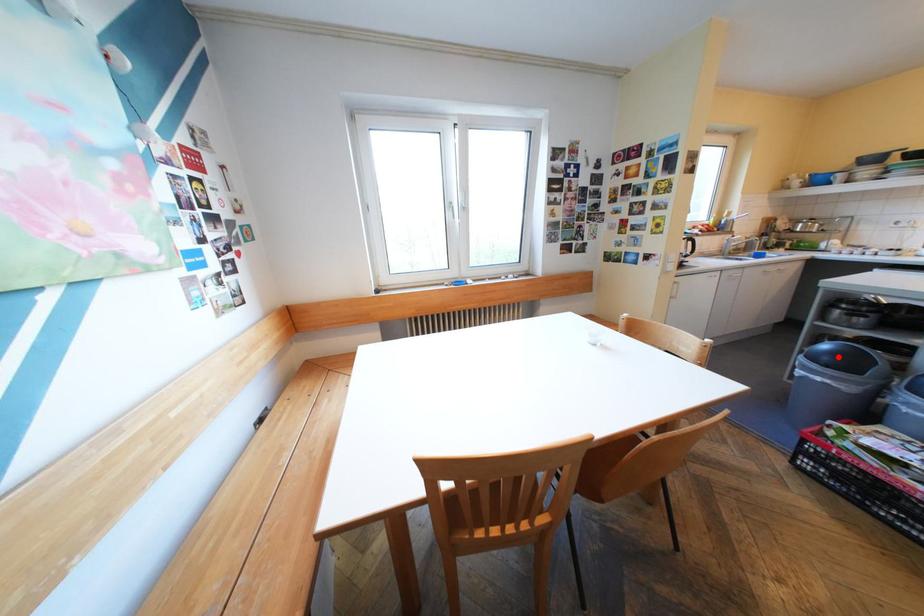
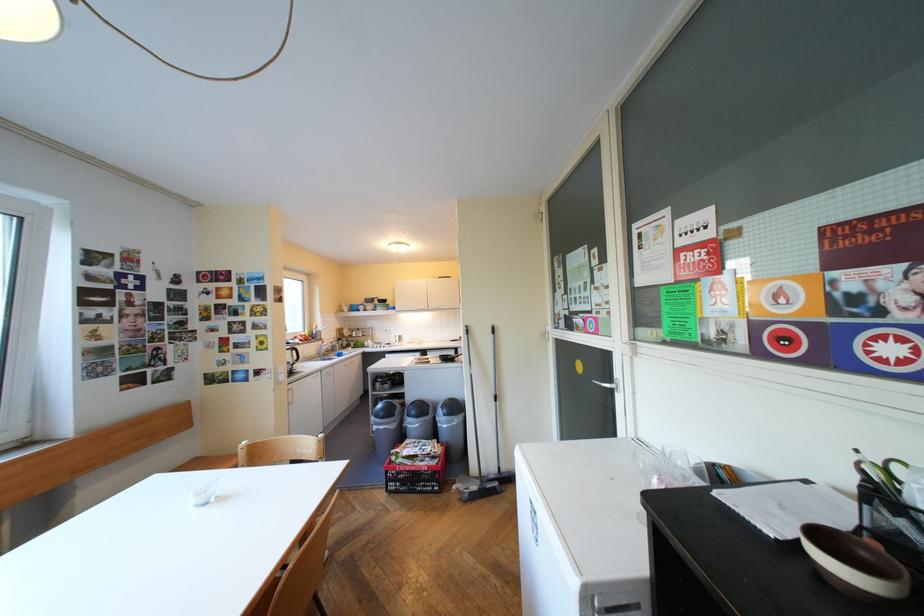
Find the pixel in the second image that matches the highlighted location in the first image.

(394, 411)